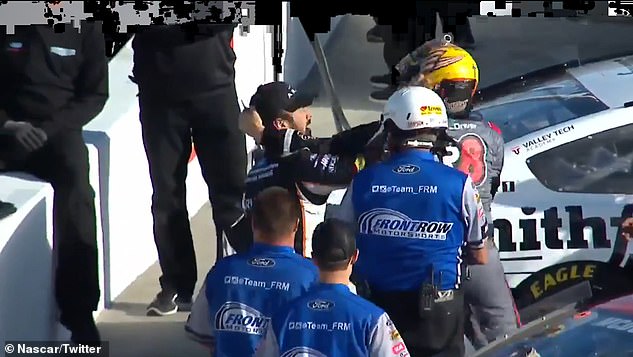
Where is `wall`? wall is located at coordinates (295, 53), (247, 64).